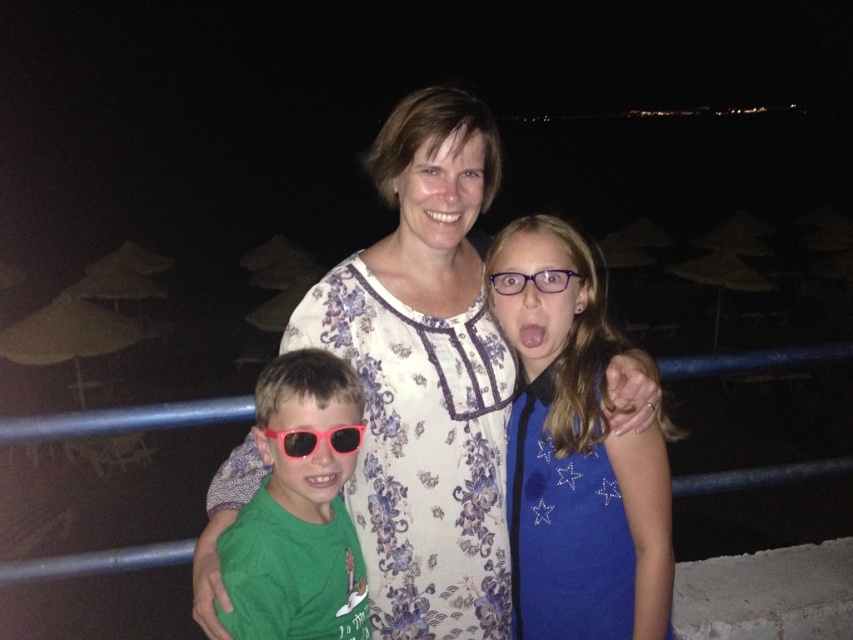
You are a photographer trying to capture a closeup shot of the blue sequined dress at center and the purple plastic glasses at center. Which object should you zoom in on first if you want to focus on the wider item?

The blue sequened dress at center is wider than the purple plastic glasses at center, so you should zoom in on the blue sequined dress at center first.

You are standing at the origin point in the image. Where is the floral cotton dress at center located in terms of coordinates?

The floral cotton dress at center is located at point (422, 452).